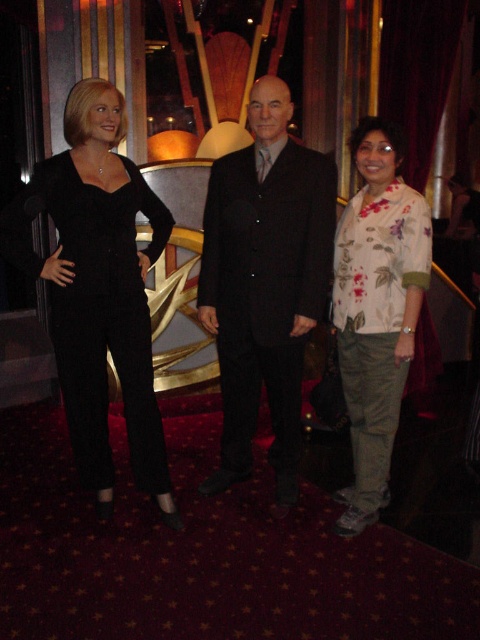
Is black matte suit at center below matte black suit at center?

Correct, black matte suit at center is located below matte black suit at center.

Can you confirm if black matte suit at center is wider than matte black suit at center?

Correct, the width of black matte suit at center exceeds that of matte black suit at center.

Image resolution: width=480 pixels, height=640 pixels. Identify the location of black matte suit at center. (265, 280).

Locate an element on the screen. The image size is (480, 640). black matte suit at center is located at coordinates (265, 280).

In the scene shown: Can you confirm if black matte jumpsuit at left is taller than matte black suit at center?

Indeed, black matte jumpsuit at left has a greater height compared to matte black suit at center.

Can you confirm if black matte jumpsuit at left is wider than matte black suit at center?

Yes, black matte jumpsuit at left is wider than matte black suit at center.

Which is behind, point (85, 161) or point (304, 294)?

Point (304, 294)

Image resolution: width=480 pixels, height=640 pixels. What are the coordinates of `black matte jumpsuit at left` in the screenshot? It's located at (98, 289).

Is black matte suit at center taller than floral print blouse at right?

Correct, black matte suit at center is much taller as floral print blouse at right.

Between point (283, 236) and point (408, 224), which one is positioned in front?

Point (408, 224) is more forward.

Where is `black matte suit at center`? This screenshot has width=480, height=640. black matte suit at center is located at coordinates (265, 280).